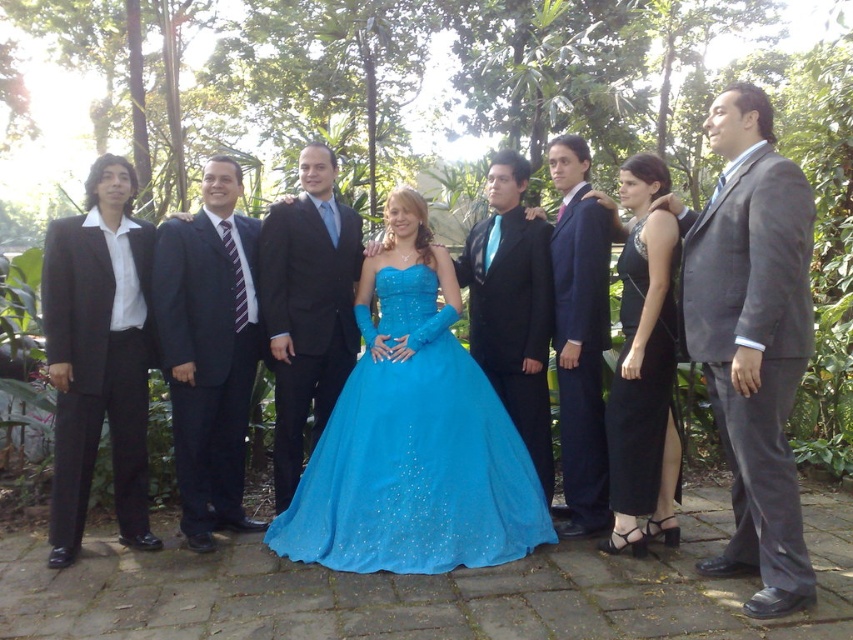
You are standing at the center of the garden where the woman in the turquoise ball gown is posing. If you want to find the gray suit at right, in which direction should you look relative to your position?

The gray suit at right is located at point 0.530 on the x axis and 0.883 on the y axis. Since you are at the center, you should look to the right and upwards to find the gray suit at right.

What is the color of the suit at the point marked by coordinates (306,307)?

The point at coordinates (306,307) is on a shiny black suit at center.